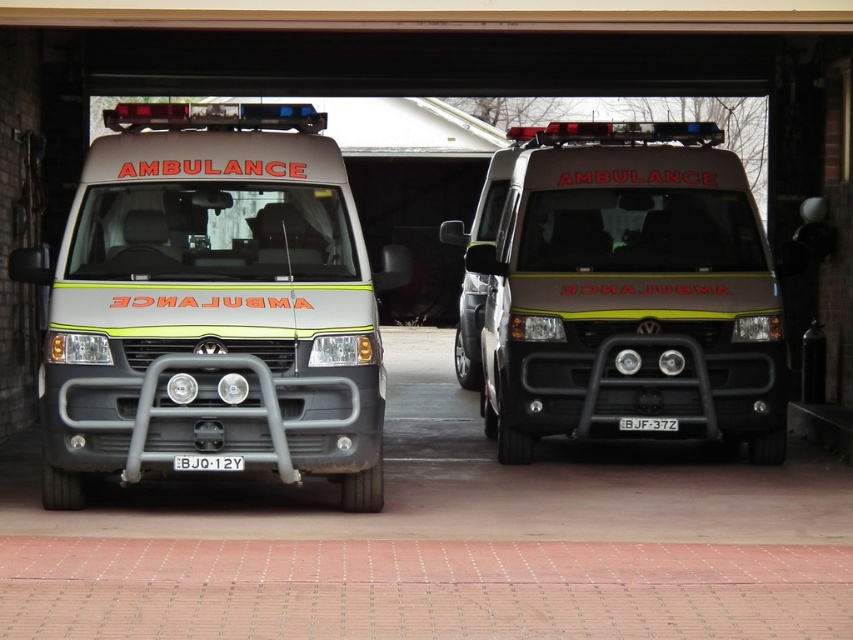
You are standing at the point marked by the coordinates point (125, 289). You want to exit the garage safely. The nearest exit is located behind the two ambulances. To reach it, you must walk around either the left ambulance or the right ambulance. Which ambulance should you choose to ensure the shortest path to the exit?

To determine the shortest path, consider the positions of the ambulances. Since both ambulances are parked side by side facing forward, the left ambulance is closer to the left side of the garage. By walking around the left ambulance, you can reach the exit more directly as it is positioned nearer to your starting point at point (125, 289) compared to the right ambulance. Therefore, choosing to go around the left ambulance would provide the shortest path to the exit.

In the scene shown: You are a delivery driver who needs to park your truck in a garage where there is a matte grey ambulance at center. Based on the ambulance location, where should you park your truck to avoid blocking the ambulance?

The matte grey ambulance at center is located at point (x=212, y=305). To avoid blocking it, park your truck in an area not overlapping with this coordinate, such as the left or right side of the garage, ensuring clear access around the ambulance.

From the picture: You are a maintenance worker needing to access both the matte grey ambulance at center and the matte silver ambulance at center. Given that you can only move 8 feet in one direction, can you reach both vehicles without moving further than that?

The matte grey ambulance at center and matte silver ambulance at center are 9.26 feet apart, which exceeds your 8 feet movement limit. Therefore, you cannot reach both vehicles without moving further than 8 feet.